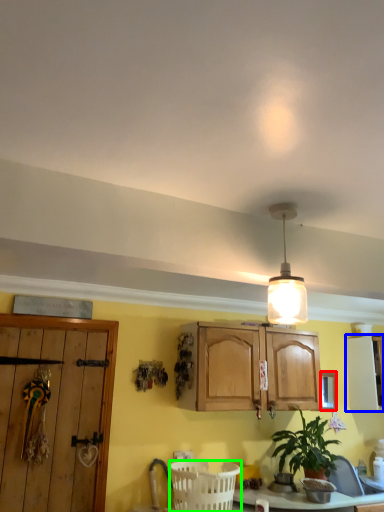
Question: Which is farther away from window (highlighted by a red box)? cabinetry (highlighted by a blue box) or basket (highlighted by a green box)?

Choices:
 (A) cabinetry
 (B) basket

Answer: (B)